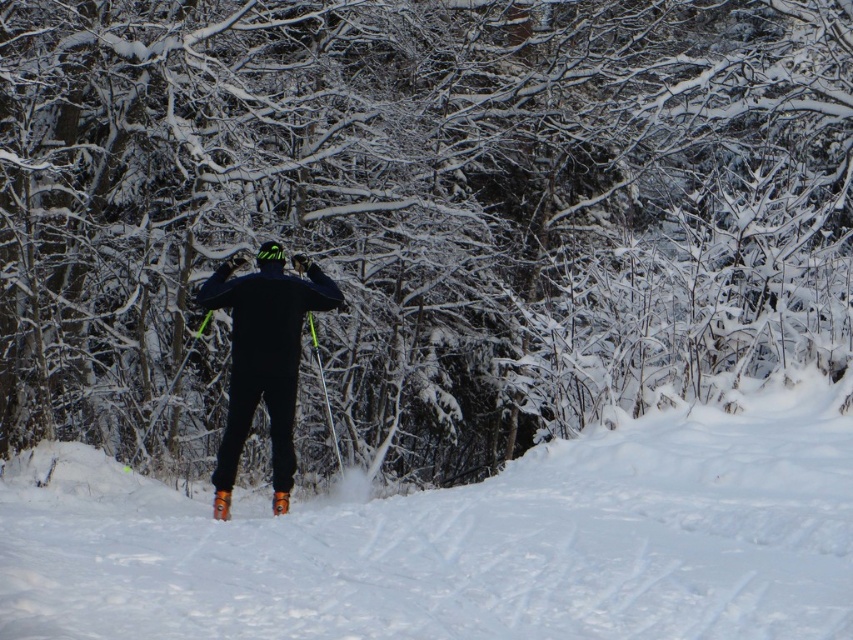
You are navigating a cross country skiing trail and see the matte black snowboarder at center. Based on their position coordinates, can you determine if they are positioned closer to the left or right side of the trail?

The matte black snowboarder at center is located at point 0.561 on the x axis, which is closer to the right side of the trail since the center is 0.5. Therefore, the snowboarder is positioned closer to the right side of the trail.

You are a photographer planning to take a picture of the matte black snowboarder at center and the white fluffy snow at center. From the photographer viewpoint, which object is positioned to the right side?

The white fluffy snow at center is positioned to the right of the matte black snowboarder at center.